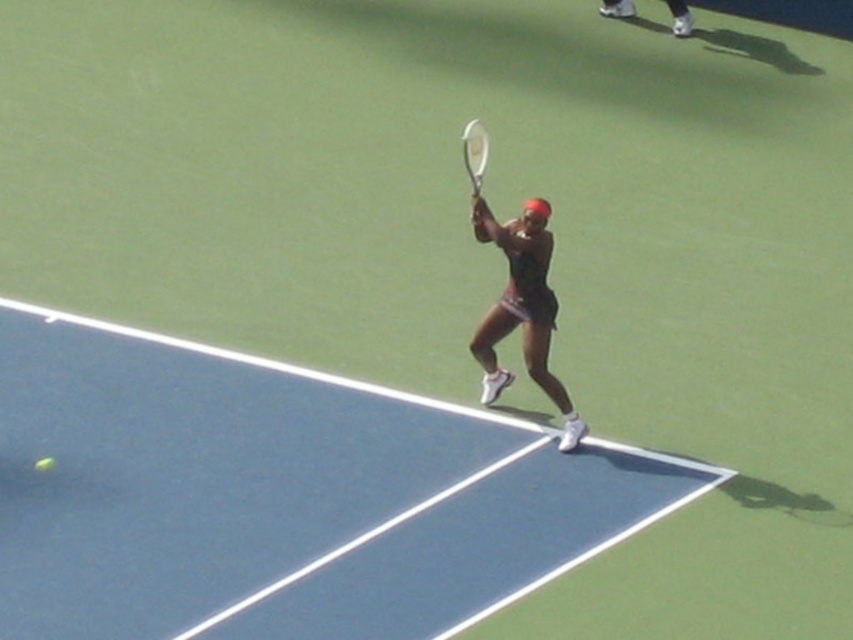
Is point (149, 636) less distant than point (492, 392)?

Yes, point (149, 636) is closer to viewer.

Is blue rubber tennis court at center to the right of black matte tennis racket at center from the viewer's perspective?

Incorrect, blue rubber tennis court at center is not on the right side of black matte tennis racket at center.

You are a GUI agent. You are given a task and a screenshot of the screen. Output one action in this format:
    pyautogui.click(x=<x>, y=<y>)
    Task: Click on the blue rubber tennis court at center
    The height and width of the screenshot is (640, 853).
    Given the screenshot: What is the action you would take?
    pyautogui.click(x=277, y=496)

The image size is (853, 640). I want to click on blue rubber tennis court at center, so pos(277,496).

Does black matte tennis racket at center appear on the right side of white metallic tennis racket at center?

Yes, black matte tennis racket at center is to the right of white metallic tennis racket at center.

Describe the element at coordinates (521, 308) in the screenshot. Image resolution: width=853 pixels, height=640 pixels. I see `black matte tennis racket at center` at that location.

Find the location of a particular element. This screenshot has width=853, height=640. black matte tennis racket at center is located at coordinates (521, 308).

From the picture: Is blue rubber tennis court at center in front of white metallic tennis racket at center?

Yes, it is in front of white metallic tennis racket at center.

Does blue rubber tennis court at center have a greater width compared to white metallic tennis racket at center?

Yes, blue rubber tennis court at center is wider than white metallic tennis racket at center.

What are the coordinates of `blue rubber tennis court at center` in the screenshot? It's located at tap(277, 496).

The height and width of the screenshot is (640, 853). Find the location of `blue rubber tennis court at center`. blue rubber tennis court at center is located at coordinates (277, 496).